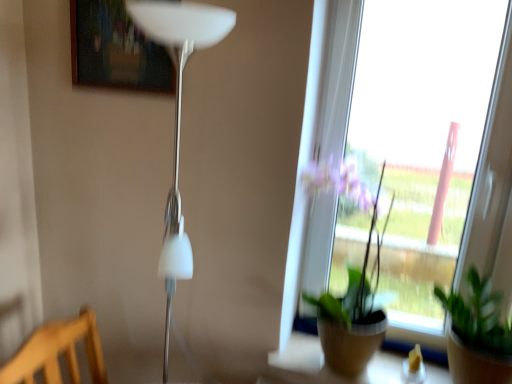
Question: Is wooden frame at upper center wider than white glossy floor lamp at left?

Choices:
 (A) yes
 (B) no

Answer: (B)

Question: Is wooden frame at upper center oriented towards white glossy floor lamp at left?

Choices:
 (A) no
 (B) yes

Answer: (A)

Question: Is wooden frame at upper center taller than white glossy floor lamp at left?

Choices:
 (A) yes
 (B) no

Answer: (B)

Question: Considering the relative sizes of wooden frame at upper center and white glossy floor lamp at left in the image provided, is wooden frame at upper center thinner than white glossy floor lamp at left?

Choices:
 (A) no
 (B) yes

Answer: (B)

Question: From a real-world perspective, is wooden frame at upper center under white glossy floor lamp at left?

Choices:
 (A) no
 (B) yes

Answer: (A)

Question: Which is correct: green matte plant at center, the 2th houseplant from the right, is inside green matte plant at lower right, the second houseplant positioned from the left, or outside of it?

Choices:
 (A) inside
 (B) outside

Answer: (B)

Question: From the image's perspective, is green matte plant at center, marked as the 1th houseplant in a left-to-right arrangement, positioned above or below green matte plant at lower right, arranged as the 1th houseplant when viewed from the right?

Choices:
 (A) below
 (B) above

Answer: (B)

Question: Is point (327, 291) positioned closer to the camera than point (442, 304)?

Choices:
 (A) closer
 (B) farther

Answer: (B)

Question: Is green matte plant at center, the 2th houseplant from the right, wider or thinner than green matte plant at lower right, the second houseplant positioned from the left?

Choices:
 (A) wide
 (B) thin

Answer: (A)

Question: In terms of height, does wooden frame at upper center look taller or shorter compared to green matte plant at center, marked as the 1th houseplant in a left-to-right arrangement?

Choices:
 (A) short
 (B) tall

Answer: (A)

Question: Is wooden frame at upper center to the left or to the right of green matte plant at center, marked as the 1th houseplant in a left-to-right arrangement, in the image?

Choices:
 (A) left
 (B) right

Answer: (A)

Question: Considering the positions of point (137, 52) and point (366, 264), is point (137, 52) closer or farther from the camera than point (366, 264)?

Choices:
 (A) farther
 (B) closer

Answer: (B)

Question: In terms of size, does wooden frame at upper center appear bigger or smaller than green matte plant at center, marked as the 1th houseplant in a left-to-right arrangement?

Choices:
 (A) big
 (B) small

Answer: (B)

Question: Relative to white glossy floor lamp at left, is green matte plant at lower right, the second houseplant positioned from the left, in front or behind?

Choices:
 (A) behind
 (B) front

Answer: (A)

Question: From a real-world perspective, is green matte plant at lower right, the second houseplant positioned from the left, above or below white glossy floor lamp at left?

Choices:
 (A) above
 (B) below

Answer: (B)